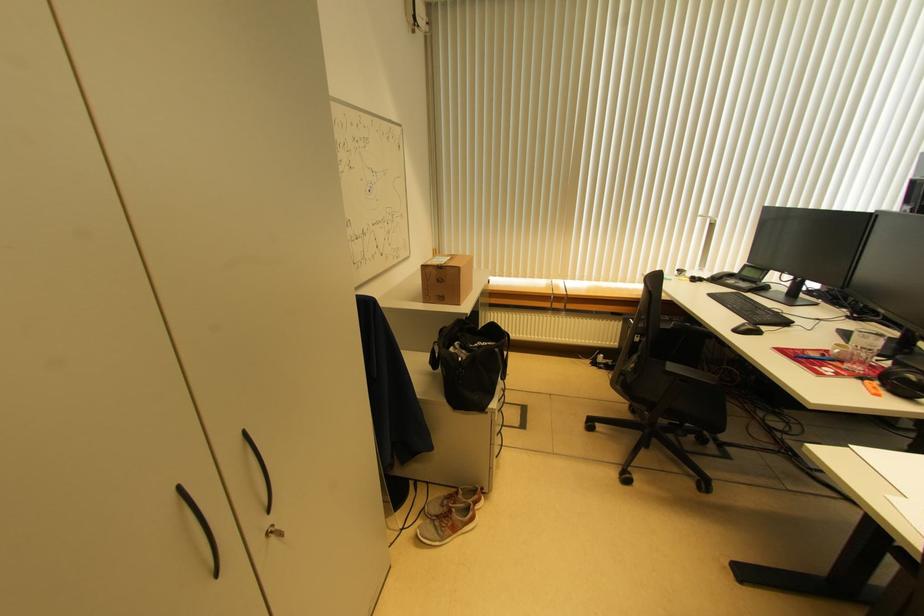
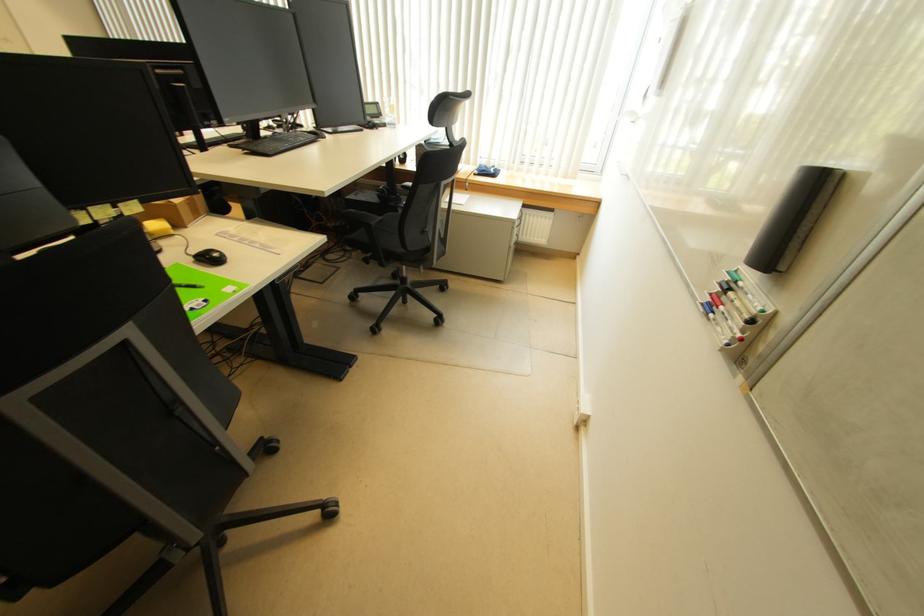
Question: Which direction would the cameraman need to move to produce the second image? Reply with the corresponding letter.

Choices:
 (A) Left
 (B) Right
 (C) Forward
 (D) Backward

Answer: (B)